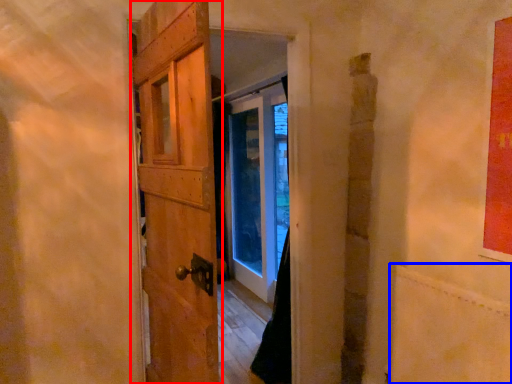
Question: Which of the following is the farthest to the observer, door (highlighted by a red box) or plywood (highlighted by a blue box)?

Choices:
 (A) door
 (B) plywood

Answer: (B)